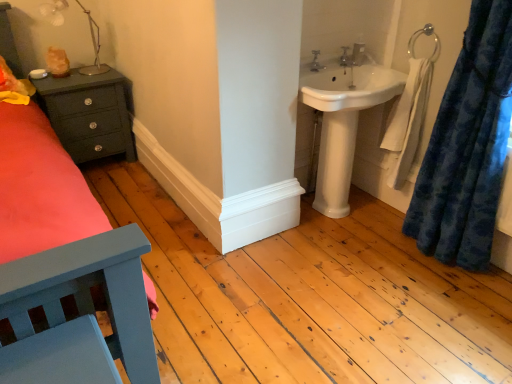
Question: From the image's perspective, is matte silver tap at upper center, positioned as the 2th tap in right-to-left order, above or below white glossy sink at upper right?

Choices:
 (A) below
 (B) above

Answer: (B)

Question: In terms of width, does matte silver tap at upper center, the 1th tap from the front, look wider or thinner when compared to white glossy sink at upper right?

Choices:
 (A) thin
 (B) wide

Answer: (A)

Question: Which object is the farthest from the blue plush curtain at right?

Choices:
 (A) metallic silver lamp at upper left
 (B) white glossy sink at upper right
 (C) silver metallic towel bar at upper right
 (D) matte dark green nightstand at left
 (E) matte silver tap at upper center, arranged as the 1th tap when viewed from the back

Answer: (A)

Question: Based on their relative distances, which object is farther from the white glossy sink at upper right?

Choices:
 (A) metallic silver lamp at upper left
 (B) matte dark green nightstand at left
 (C) silver metallic towel bar at upper right
 (D) blue plush curtain at right
 (E) matte silver tap at upper center, the second tap viewed from the back

Answer: (A)